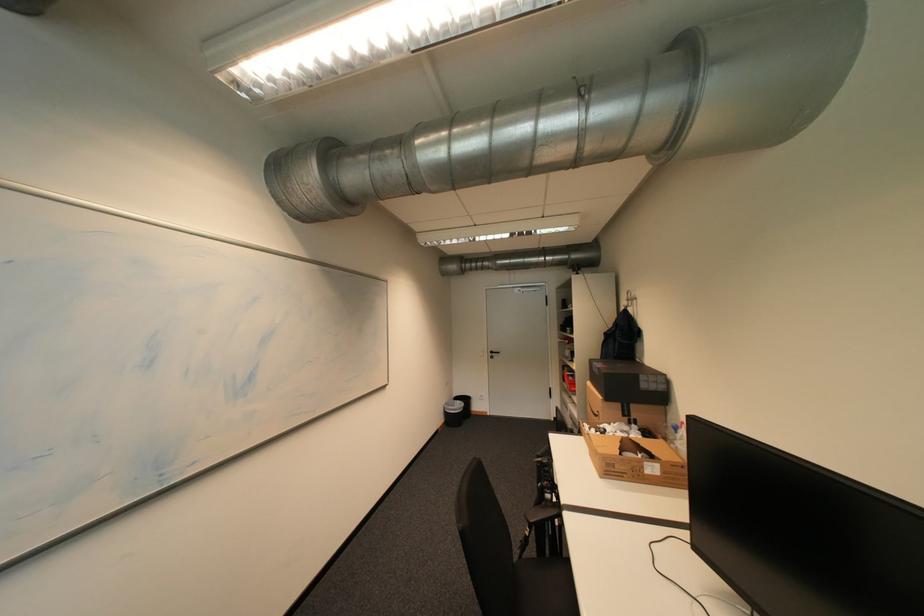
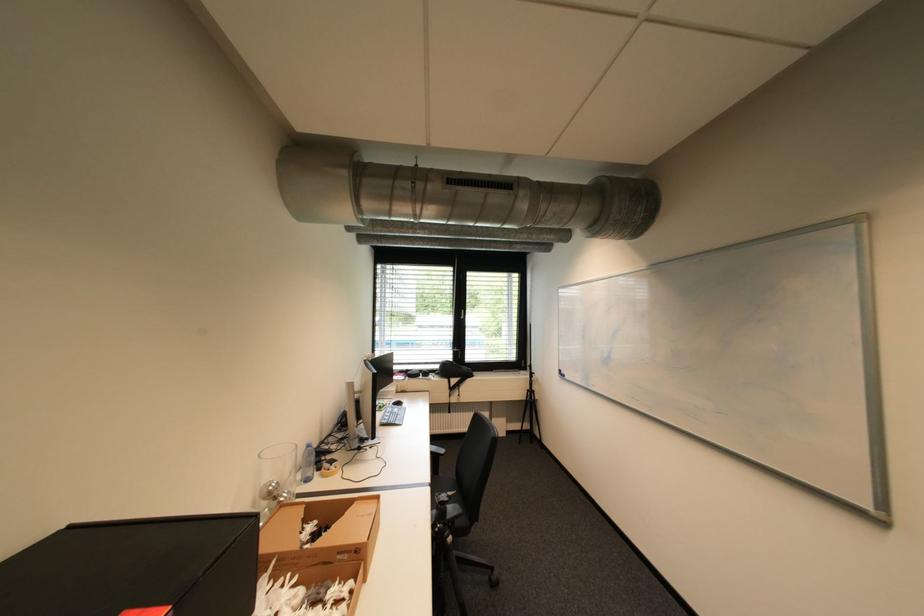
Find the pixel in the second image that matches (660,454) in the first image.

(311, 520)